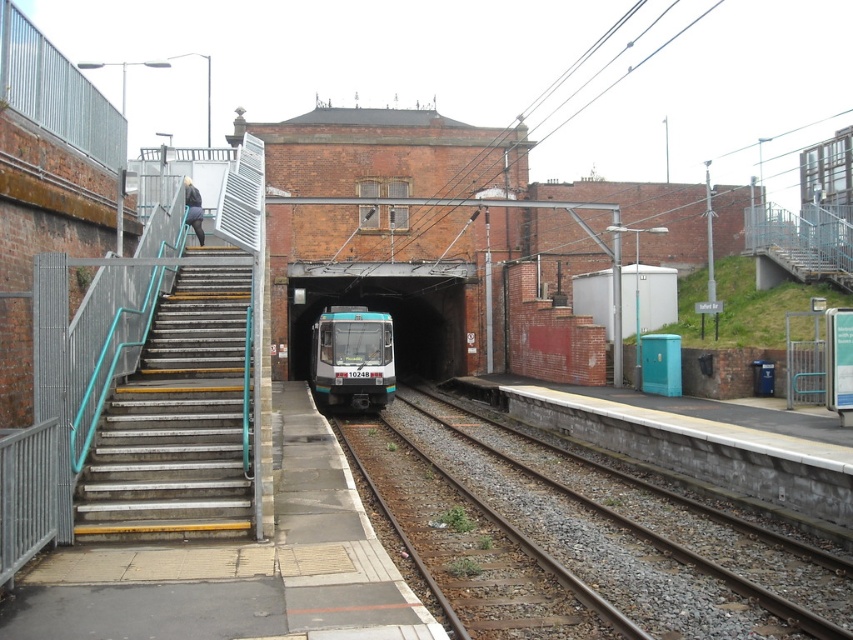
Question: Is metal/stainless steel stairs at left below teal glass train at center?

Choices:
 (A) yes
 (B) no

Answer: (A)

Question: Estimate the real-world distances between objects in this image. Which object is farther from the teal glass train at center?

Choices:
 (A) smooth concrete tracks at center
 (B) metal/stainless steel stairs at left
 (C) teal glossy train at center

Answer: (B)

Question: Which of the following is the farthest from the observer?

Choices:
 (A) (155, 525)
 (B) (375, 400)

Answer: (B)

Question: Observing the image, what is the correct spatial positioning of smooth concrete tracks at center in reference to teal glass train at center?

Choices:
 (A) right
 (B) left

Answer: (A)

Question: Which of these objects is positioned farthest from the metal/stainless steel stairs at left?

Choices:
 (A) teal glossy train at center
 (B) teal glass train at center

Answer: (B)

Question: Does smooth concrete tracks at center appear on the right side of teal glossy train at center?

Choices:
 (A) no
 (B) yes

Answer: (B)